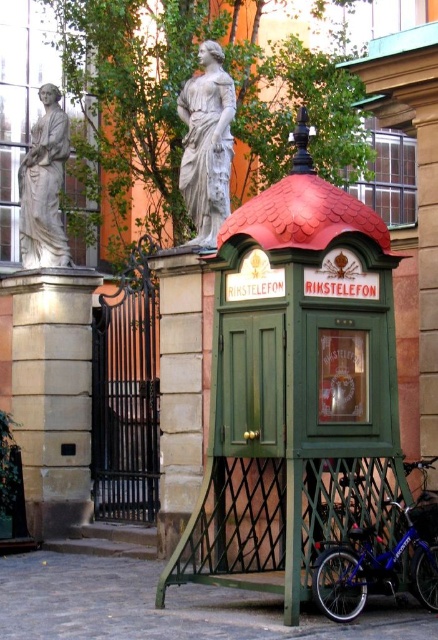
You are standing at the point labeled as point (295, 387) in the image. What object are you touching?

You are touching the green wood telephone booth at center because the point (295, 387) is on it.

You are a photographer standing in front of the vintage telephone booth. You want to take a photo that includes both the telephone booth and the black wrought iron gate. However, your camera has a limited depth of field and can only focus on objects at a certain distance. Which of the two points, point (x=423, y=499) or point (x=46, y=172), is closer to the camera and should be prioritized for focus to ensure the telephone booth and gate are sharp?

Point (x=423, y=499) is closer to the camera than point (x=46, y=172). Therefore, focusing on point (x=423, y=499) will help ensure both the telephone booth and the gate are in focus since it is nearer to the camera.